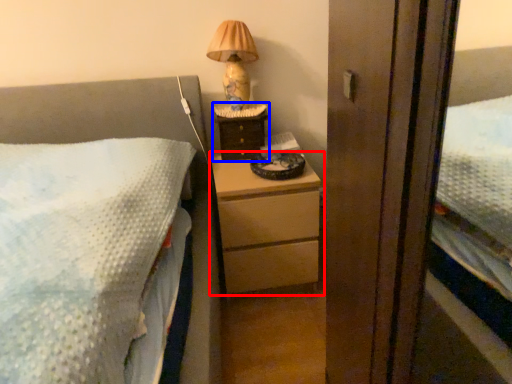
Question: Which of the following is the farthest to the observer, chest of drawers (highlighted by a red box) or nightstand (highlighted by a blue box)?

Choices:
 (A) chest of drawers
 (B) nightstand

Answer: (B)